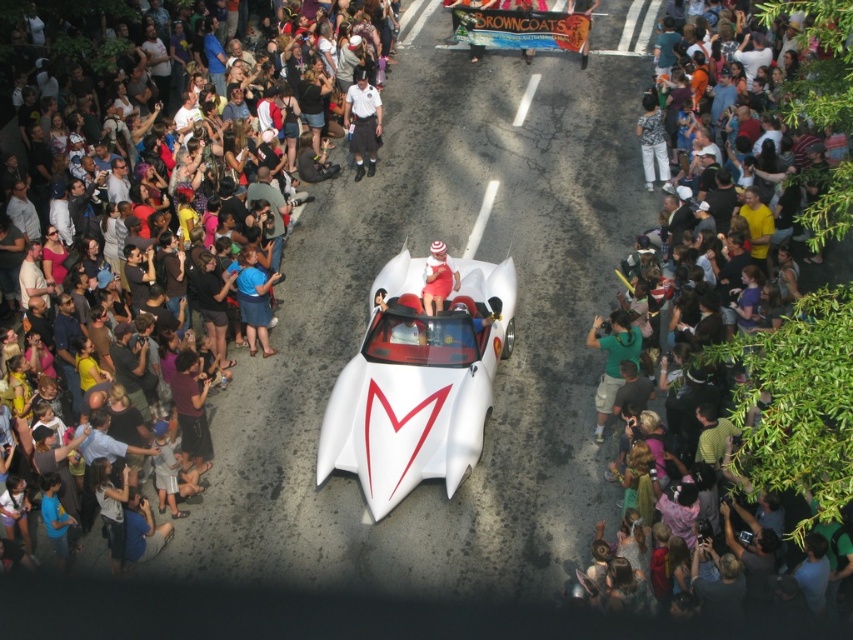
Question: Is white matte sports car at center below green fabric shirt at right?

Choices:
 (A) yes
 (B) no

Answer: (B)

Question: Estimate the real-world distances between objects in this image. Which object is closer to the matte black crowd at center?

Choices:
 (A) matte red dress at center
 (B) dark clothing crowd at center

Answer: (A)

Question: Does matte black crowd at center appear under dark clothing crowd at center?

Choices:
 (A) no
 (B) yes

Answer: (A)

Question: Which object appears farthest from the camera in this image?

Choices:
 (A) matte red dress at center
 (B) dark clothing crowd at center
 (C) white uniform at center
 (D) matte black crowd at center

Answer: (C)

Question: Can you confirm if matte black crowd at center is positioned to the right of dark clothing crowd at center?

Choices:
 (A) yes
 (B) no

Answer: (B)

Question: Which point is farther to the camera?

Choices:
 (A) (361, 172)
 (B) (447, 289)
 (C) (846, 353)

Answer: (A)